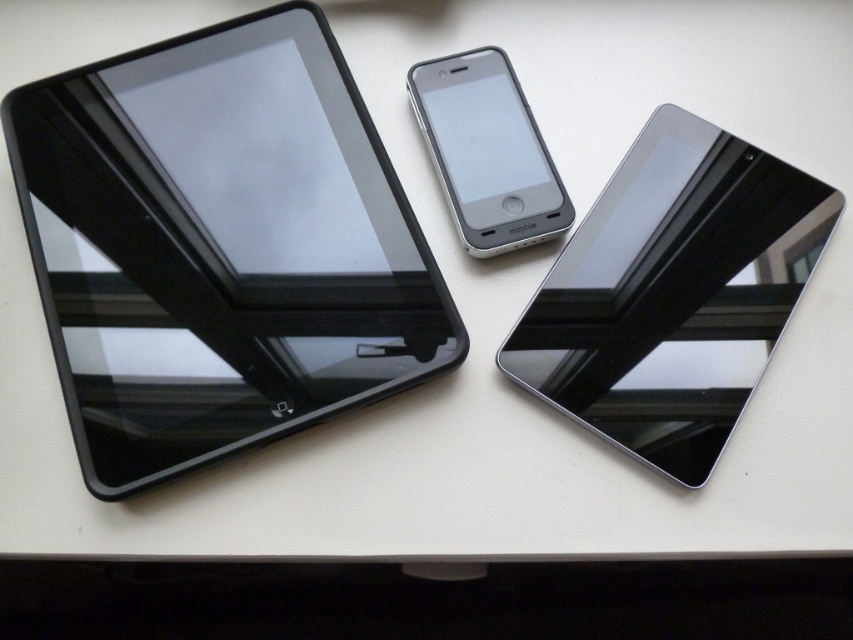
You are organizing a desk and need to place a new keyboard between the black glossy tablet at left and the matte black tablet at center. According to the scene, where should you position the keyboard?

The black glossy tablet at left is to the left of the matte black tablet at center, so you should place the keyboard between them in the middle area between the two tablets.

You are organizing a tech showcase and need to arrange two tablets on a desk. The glossy black tablet at center and the matte black tablet at center must be placed according to their positions in the image. Which tablet should be on the left side of the desk?

The matte black tablet at center should be on the left side of the desk because the glossy black tablet at center is to its right in the image.

From the picture: You are organizing a desk and need to stack the black glossy tablet at left and the glossy black tablet at center. Which one should be placed on top to ensure stability?

The black glossy tablet at left should be placed on top of the glossy black tablet at center because it is above it, indicating it is lighter or smaller, ensuring stability.